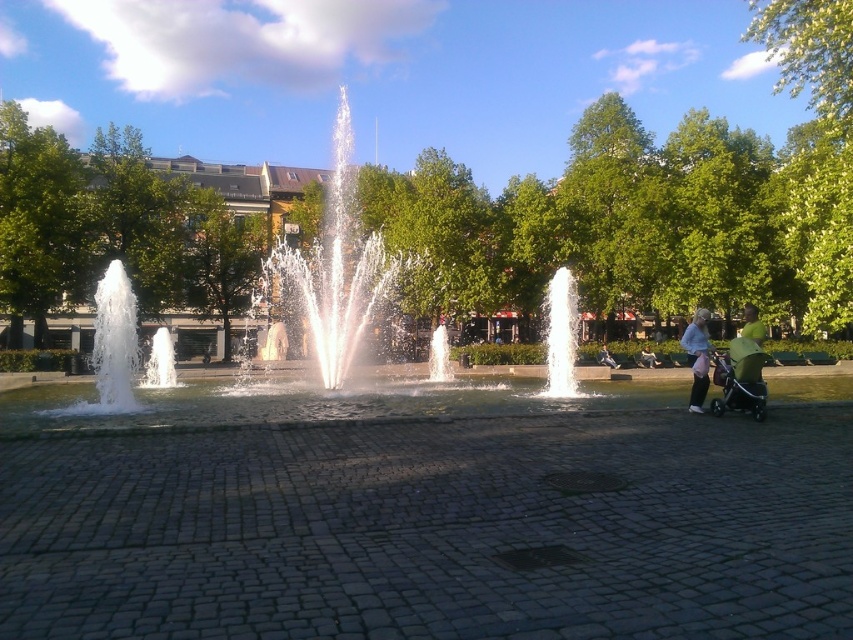
Which is more to the left, white frothy water at left or green fabric jacket at right?

From the viewer's perspective, white frothy water at left appears more on the left side.

In order to click on white frothy water at left in this screenshot , I will do `click(112, 346)`.

Can you confirm if white water at center is wider than white frothy water at left?

No, white water at center is not wider than white frothy water at left.

I want to click on white water at center, so pyautogui.click(x=335, y=268).

Which is behind, point (335, 209) or point (102, 284)?

Positioned behind is point (335, 209).

Locate an element on the screen. The height and width of the screenshot is (640, 853). white water at center is located at coordinates (335, 268).

This screenshot has width=853, height=640. What do you see at coordinates (561, 336) in the screenshot?
I see `clear glass water at center` at bounding box center [561, 336].

What do you see at coordinates (561, 336) in the screenshot? The image size is (853, 640). I see `clear glass water at center` at bounding box center [561, 336].

Locate an element on the screen. clear glass water at center is located at coordinates (561, 336).